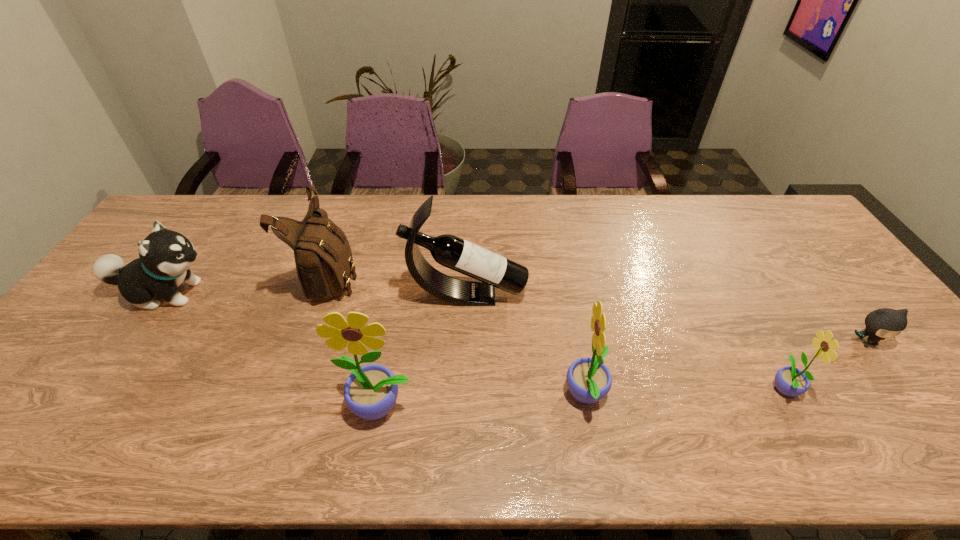
In the image, there is a desktop. Where is `vacant space at the far edge`? This screenshot has width=960, height=540. vacant space at the far edge is located at coordinates tap(701, 223).

What are the coordinates of `vacant space at the near edge of the desktop` in the screenshot? It's located at (254, 408).

In the image, there is a desktop. In order to click on free space at the right edge in this screenshot , I will do `click(842, 273)`.

Locate an element on the screen. vacant space at the far left corner of the desktop is located at coordinates (190, 197).

Find the location of a particular element. The width and height of the screenshot is (960, 540). free space at the near left corner of the desktop is located at coordinates (25, 415).

This screenshot has width=960, height=540. In order to click on free space between the wine bottle and the fifth object from left to right in this screenshot , I will do `click(526, 346)`.

You are a GUI agent. You are given a task and a screenshot of the screen. Output one action in this format:
    pyautogui.click(x=<x>, y=<y>)
    Task: Click on the free point between the shoulder bag and the rightmost sunflower
    
    Given the screenshot: What is the action you would take?
    pyautogui.click(x=558, y=330)

The height and width of the screenshot is (540, 960). Find the location of `vacant space in between the rightmost sunflower and the wine bottle`. vacant space in between the rightmost sunflower and the wine bottle is located at coordinates (625, 341).

Identify the location of empty space between the wine bottle and the kitten. Image resolution: width=960 pixels, height=540 pixels. (666, 319).

You are a GUI agent. You are given a task and a screenshot of the screen. Output one action in this format:
    pyautogui.click(x=<x>, y=<y>)
    Task: Click on the empty location between the leftmost sunflower and the rightmost object
    
    Given the screenshot: What is the action you would take?
    pyautogui.click(x=624, y=374)